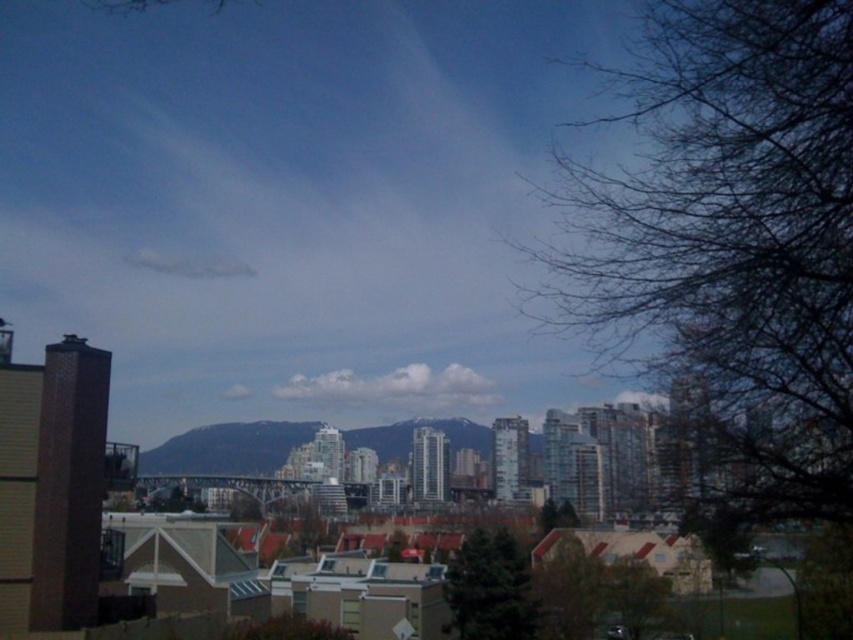
Question: Which point appears farthest from the camera in this image?

Choices:
 (A) (264, 637)
 (B) (634, 582)

Answer: (B)

Question: Can you confirm if bare branches at right is positioned above green matte tree at center?

Choices:
 (A) no
 (B) yes

Answer: (B)

Question: Estimate the real-world distances between objects in this image. Which object is closer to the green leafy tree at lower center?

Choices:
 (A) green matte tree at center
 (B) green leafy tree at lower right
 (C) bare branches at right
 (D) green matte tree at lower right

Answer: (A)

Question: Among these points, which one is nearest to the camera?

Choices:
 (A) (236, 497)
 (B) (495, 532)
 (C) (540, 634)

Answer: (C)

Question: Does green matte tree at lower right appear over green leafy tree at lower center?

Choices:
 (A) yes
 (B) no

Answer: (A)

Question: Does green matte tree at center appear on the left side of green matte tree at lower center?

Choices:
 (A) yes
 (B) no

Answer: (B)